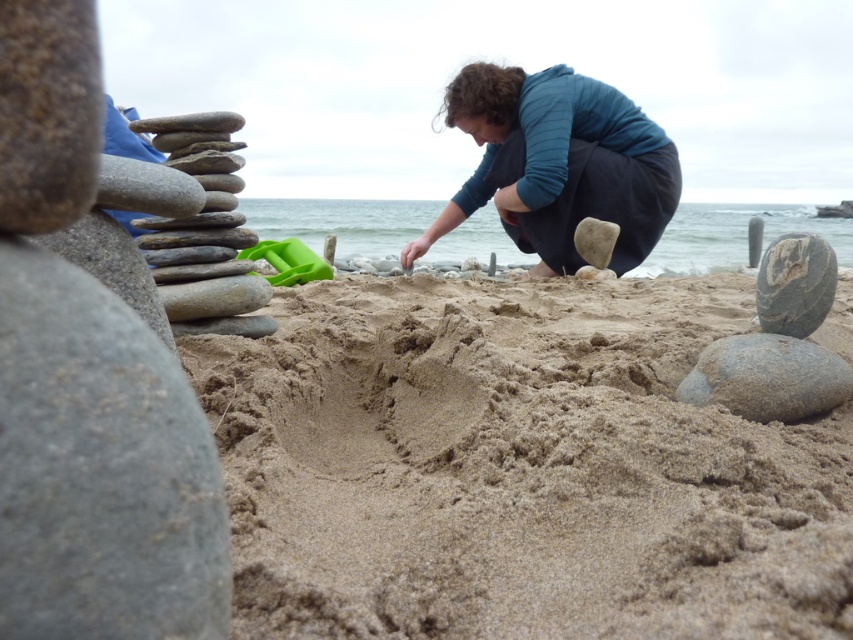
Question: Which of the following is the closest to the observer?

Choices:
 (A) (764, 577)
 (B) (521, 164)

Answer: (A)

Question: In this image, where is smooth gray stones at left located relative to smooth gray rock at right?

Choices:
 (A) below
 (B) above

Answer: (B)

Question: Which point is farther to the camera?

Choices:
 (A) (154, 221)
 (B) (779, 403)
 (C) (579, 160)
 (D) (773, 276)

Answer: (C)

Question: Observing the image, what is the correct spatial positioning of smooth gray stones at left in reference to smooth gray rock at right?

Choices:
 (A) left
 (B) right

Answer: (A)

Question: Among these objects, which one is nearest to the camera?

Choices:
 (A) smooth gray stones at left
 (B) gray smooth rock at lower right

Answer: (B)

Question: Can you confirm if dark blue fabric at center is positioned below smooth gray stones at left?

Choices:
 (A) no
 (B) yes

Answer: (A)